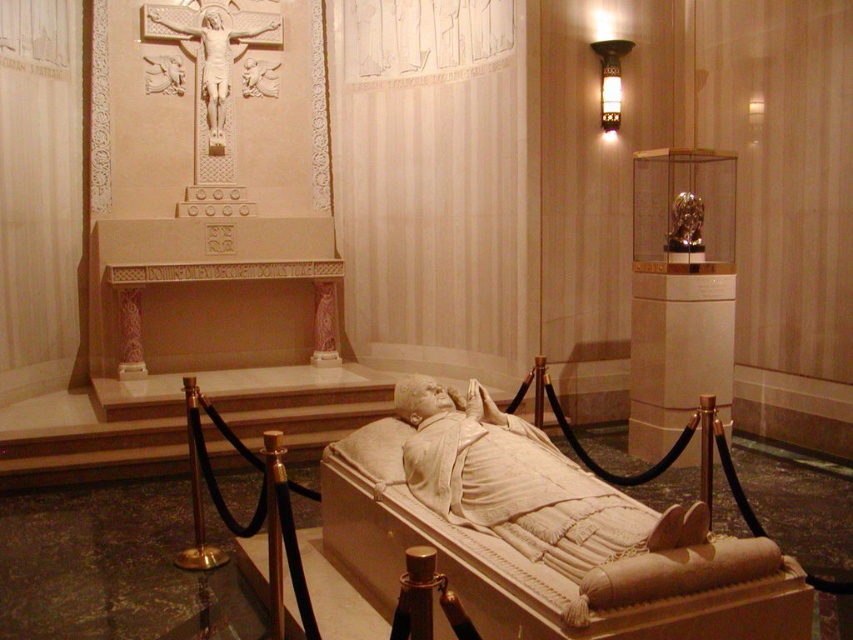
You are standing in the church and want to take a photo of both the white marble statue at center and the white marble crucifix at upper center. Which object should you position to your left side in the camera frame to include both in the photo?

The white marble crucifix at upper center should be positioned to your left side in the camera frame because the white marble statue at center is to the right of it.

In the scene shown: You are standing in the center of the room and want to move directly towards the white marble statue at center. Which direction should you move?

Since the white marble statue at center is located at point (558, 504), you should move forward towards it as it is already positioned at the center of the room.

You are an architect designing a new chapel. You want to place a 5.5 meter long wooden bench in the space between the white marble statue at center and the white marble crucifix at upper center. Is there enough space for the bench to fit between them?

The distance between the white marble statue at center and the white marble crucifix at upper center is 5.20 meters. Since the bench is 5.5 meters long, it is slightly longer than the available space. Therefore, the bench would not fit comfortably between them. Consider shortening the bench or choosing a different location.